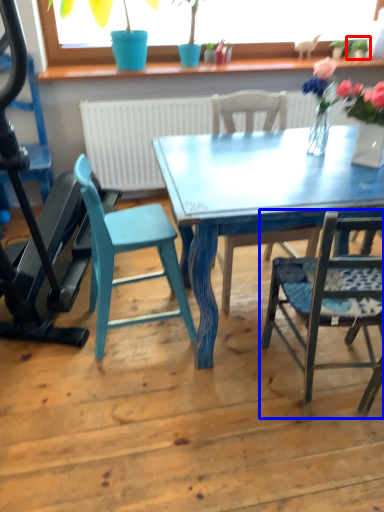
Question: Which point is closer to the camera, plant (highlighted by a red box) or chair (highlighted by a blue box)?

Choices:
 (A) plant
 (B) chair

Answer: (B)